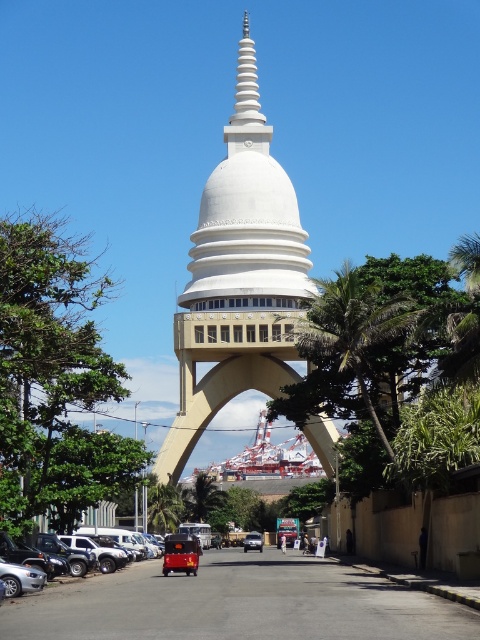
Looking at this image, you are a photographer wanting to capture the white smooth stupa at center without any obstructions. You notice a silver metallic car at lower left in the scene. Based on their positions, can you position yourself so that the car is not visible in your shot of the stupa?

The silver metallic car at lower left is behind the white smooth stupa at center, so if you position yourself in front of the stupa, the car will be hidden behind it and won not be visible in your shot of the white smooth stupa at center.

You are a tourist standing in front of the white smooth stupa at center and the metallic silver car at center. Which object is closer to you?

The white smooth stupa at center is closer to you since it is in front of the metallic silver car at center.

You are a photographer trying to capture both the silver metallic car at lower left and the metallic silver car at center in a single frame. Based on their positions, which car should you focus on first to ensure both are in the shot?

The silver metallic car at lower left is above the metallic silver car at center, so focusing on the silver metallic car at lower left first will ensure both cars are within the frame.